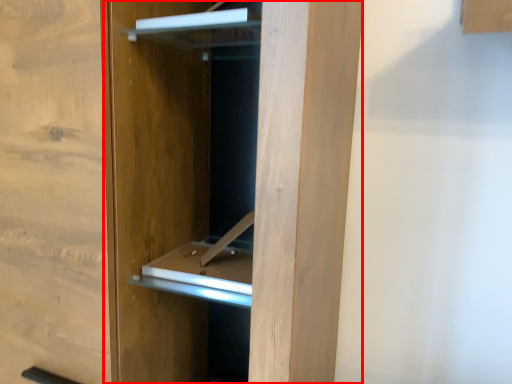
Question: Considering the relative positions of door (annotated by the red box) and cabinet in the image provided, where is door (annotated by the red box) located with respect to the staircase?

Choices:
 (A) left
 (B) right

Answer: (A)